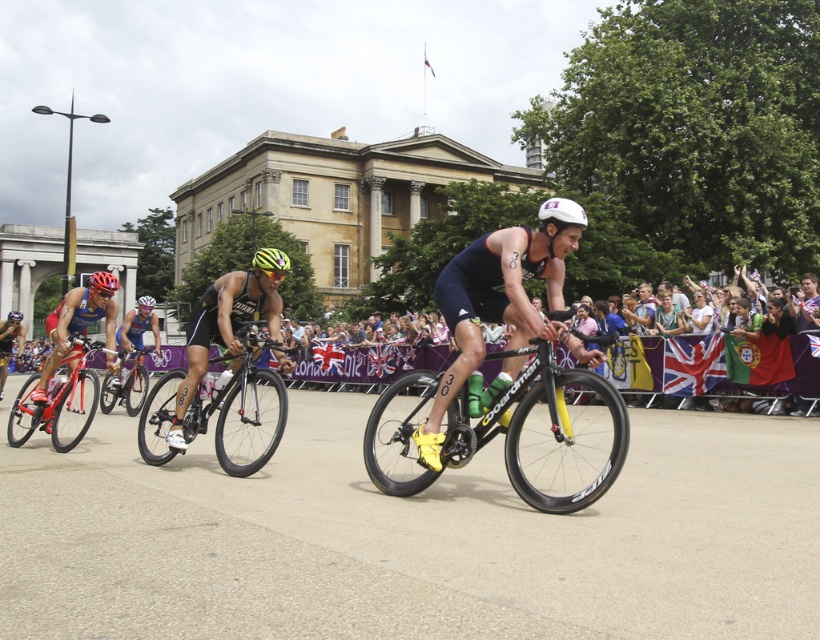
Question: Which point is closer to the camera taking this photo?

Choices:
 (A) (119, 380)
 (B) (272, 256)

Answer: (B)

Question: Among these objects, which one is farthest from the camera?

Choices:
 (A) matte yellow helmet at center
 (B) white matte bicycle helmet at center

Answer: (A)

Question: Based on their relative distances, which object is farther from the shiny red bicycle at left?

Choices:
 (A) matte yellow helmet at center
 (B) matte black helmet at center
 (C) shiny silver bicycle at center
 (D) black matte bicycle at center

Answer: (B)

Question: Can you confirm if shiny black bike at center is positioned below matte yellow helmet at center?

Choices:
 (A) yes
 (B) no

Answer: (A)

Question: In this image, where is yellow matte helmet at center located relative to yellow matte bicycle helmet at center?

Choices:
 (A) right
 (B) left

Answer: (A)

Question: Can you confirm if black matte bicycle at center is positioned to the left of matte yellow helmet at center?

Choices:
 (A) yes
 (B) no

Answer: (B)